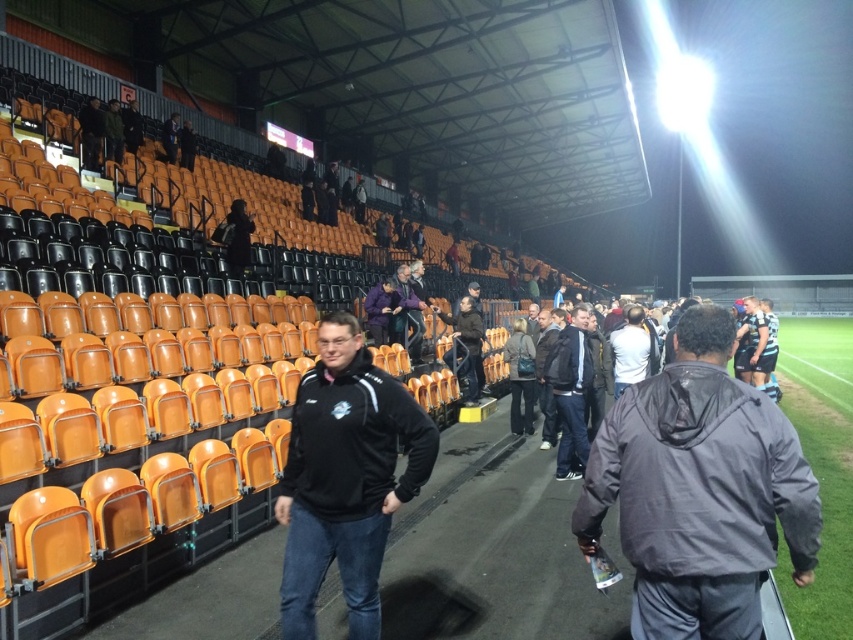
This screenshot has width=853, height=640. What do you see at coordinates (345, 477) in the screenshot? I see `black matte jacket at center` at bounding box center [345, 477].

Is point (412, 419) positioned in front of point (556, 360)?

Yes.

Where is `black matte jacket at center`? This screenshot has width=853, height=640. black matte jacket at center is located at coordinates (345, 477).

How distant is dark blue jacket at center from purple softshell jacket at upper center?

dark blue jacket at center and purple softshell jacket at upper center are 3.54 meters apart from each other.

Locate an element on the screen. dark blue jacket at center is located at coordinates (570, 392).

Where is `dark blue jacket at center`? dark blue jacket at center is located at coordinates (570, 392).

This screenshot has width=853, height=640. I want to click on dark blue jacket at center, so click(570, 392).

Is black matte jacket at center closer to the viewer compared to dark brown leather jacket at center?

Yes, it is.

Is point (395, 404) closer to camera compared to point (456, 349)?

Yes, point (395, 404) is closer to viewer.

This screenshot has height=640, width=853. I want to click on black matte jacket at center, so click(345, 477).